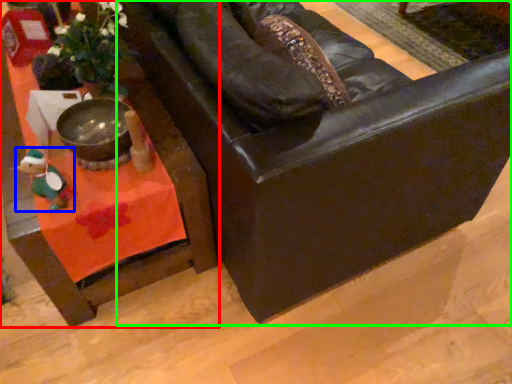
Question: Which object is the closest to the table (highlighted by a red box)? Choose among these: toy (highlighted by a blue box) or chair (highlighted by a green box).

Choices:
 (A) toy
 (B) chair

Answer: (A)